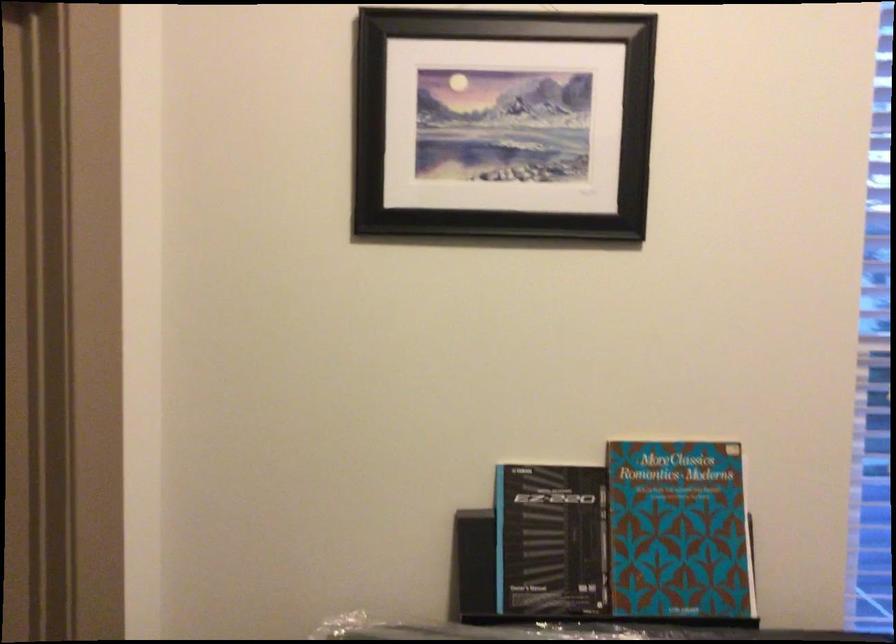
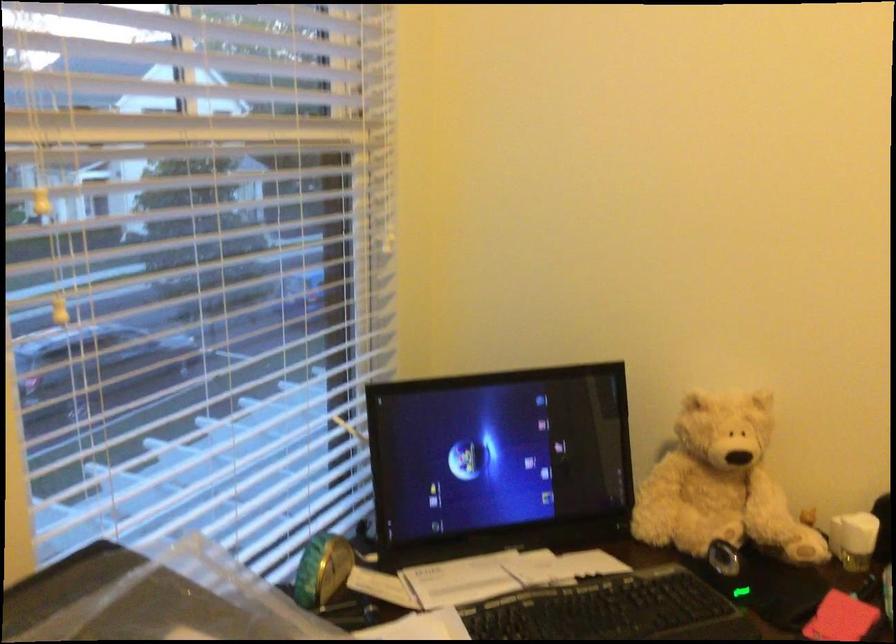
Question: Based on the continuous images, in which direction is the camera rotating? Reply with the corresponding letter.

Choices:
 (A) Left
 (B) Right
 (C) Up
 (D) Down

Answer: (B)